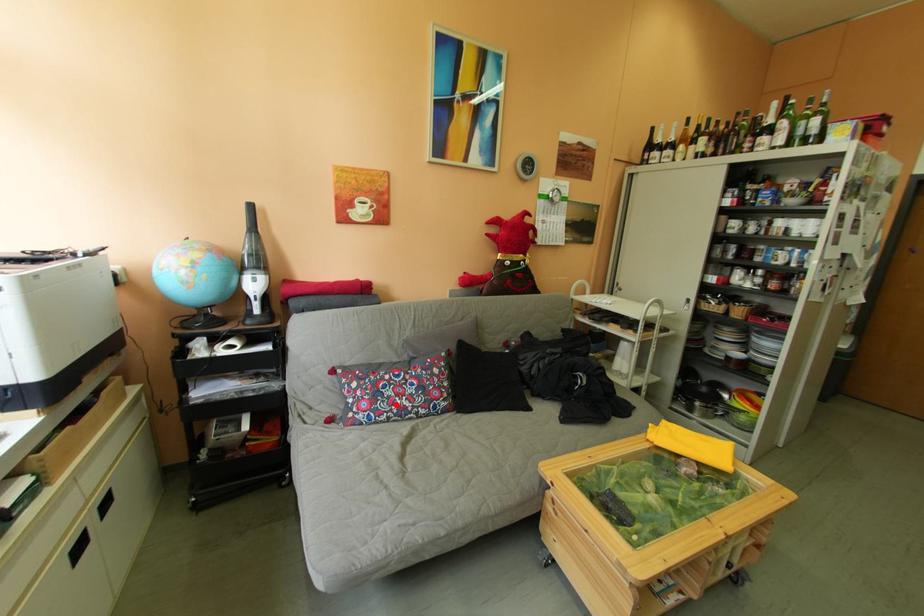
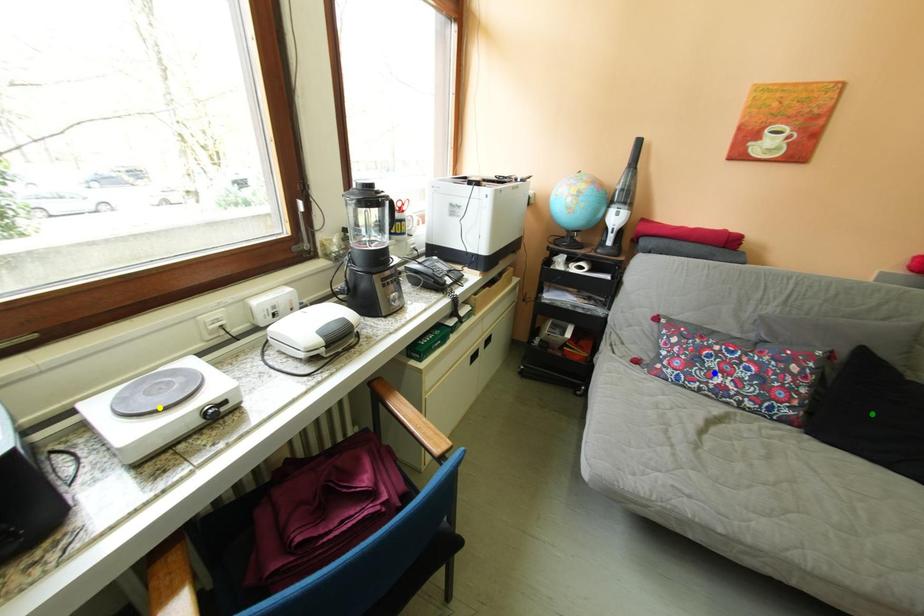
Question: I am providing you with two images of the same scene from different viewpoints. A red point is marked on the first image. You are given multiple points on the second image. Which point in image 2 is actually the same real-world point as the red point in image 1?

Choices:
 (A) blue point
 (B) green point
 (C) yellow point

Answer: (A)